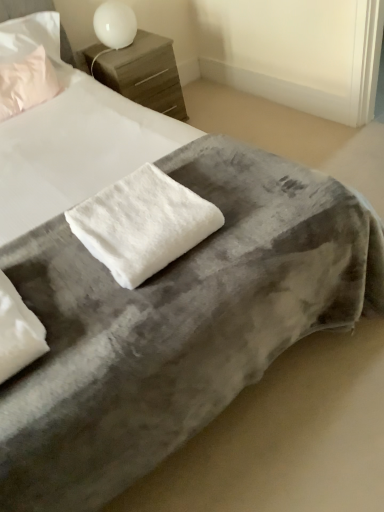
Find the location of `free spot to the right of white fluffy towel at center`. free spot to the right of white fluffy towel at center is located at coordinates tap(254, 217).